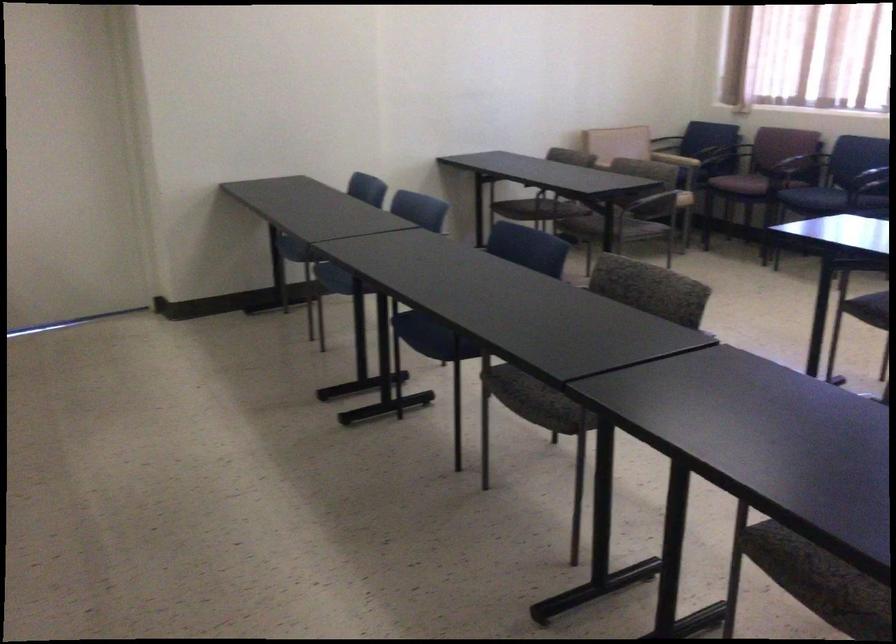
In order to click on beige chair armrest in this screenshot , I will do `click(655, 204)`.